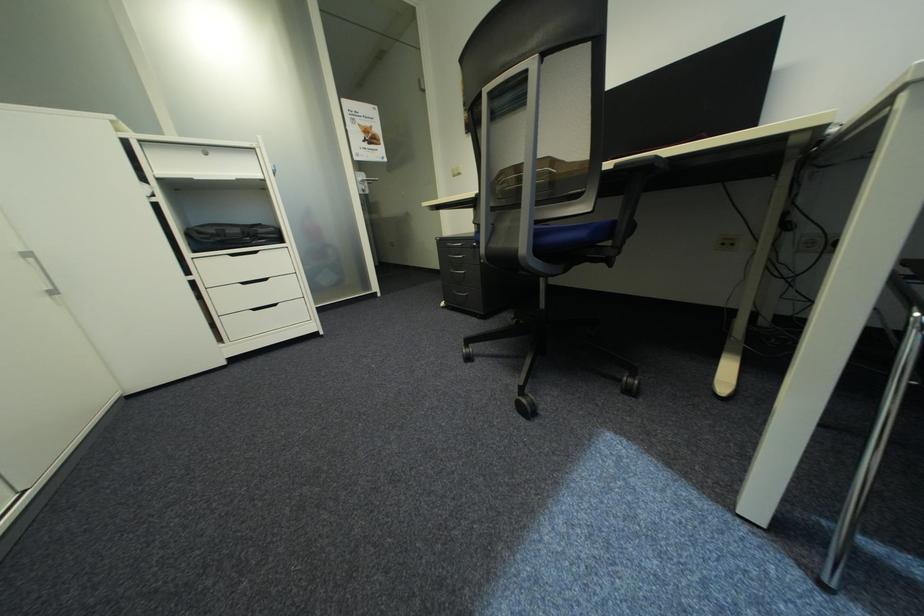
Locate an element on the screen. This screenshot has height=616, width=924. black chair armrest is located at coordinates (646, 163).